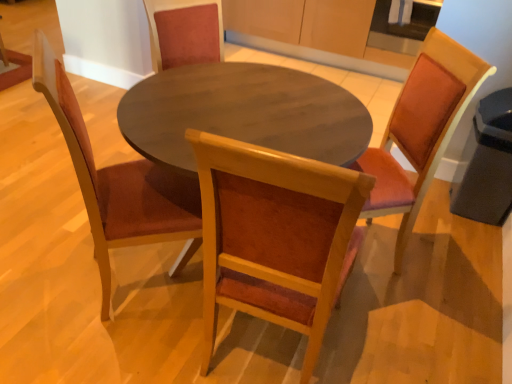
The width and height of the screenshot is (512, 384). In order to click on vacant area that lies to the right of wooden chair at center, the 2th chair from the left in this screenshot , I will do `click(380, 333)`.